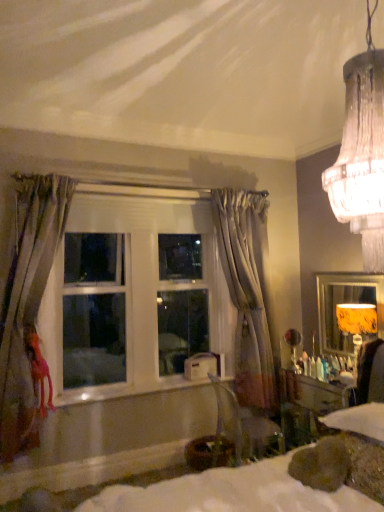
Where is `empty space that is ontop of white glossy window sill at center (from a real-world perspective)`? The image size is (384, 512). empty space that is ontop of white glossy window sill at center (from a real-world perspective) is located at coordinates (144, 388).